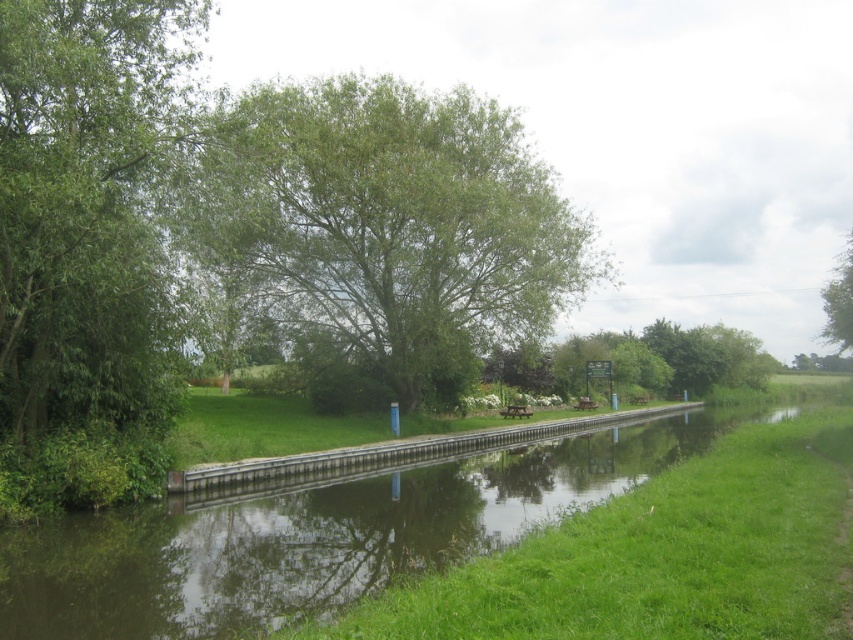
Question: Is green leafy tree at center closer to the viewer compared to green grass at center?

Choices:
 (A) no
 (B) yes

Answer: (A)

Question: Which point is farther to the camera?

Choices:
 (A) (755, 580)
 (B) (839, 323)

Answer: (B)

Question: Which point is closer to the camera taking this photo?

Choices:
 (A) (567, 586)
 (B) (489, 164)

Answer: (A)

Question: Can you confirm if green grass at center is positioned to the left of green leafy tree at upper right?

Choices:
 (A) no
 (B) yes

Answer: (B)

Question: Can you confirm if green leafy tree at left is positioned to the left of green grass at center?

Choices:
 (A) yes
 (B) no

Answer: (A)

Question: Estimate the real-world distances between objects in this image. Which object is closer to the green grass at center?

Choices:
 (A) green leafy tree at upper right
 (B) green leafy tree at center
 (C) green leafy tree at left

Answer: (C)